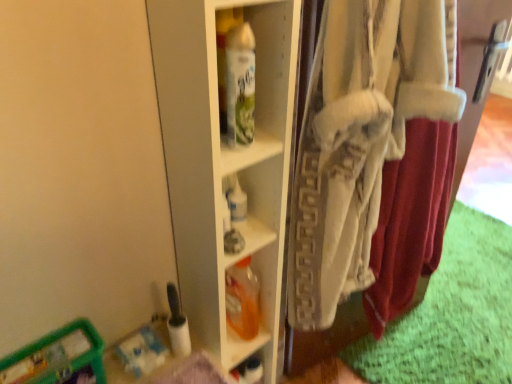
The height and width of the screenshot is (384, 512). Find the location of `free point above translucent plastic container at lower left (from a real-world perspective)`. free point above translucent plastic container at lower left (from a real-world perspective) is located at coordinates pos(44,355).